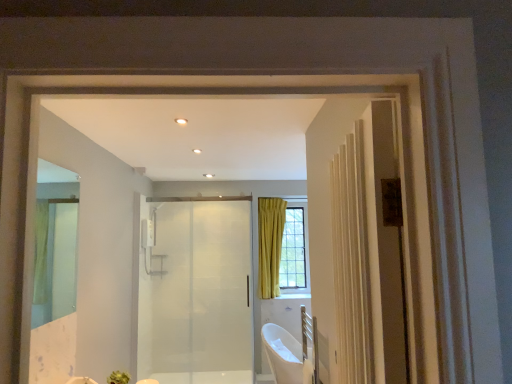
Question: Considering the positions of clear glass mirror at left and transparent glass door at center in the image, is clear glass mirror at left wider or thinner than transparent glass door at center?

Choices:
 (A) wide
 (B) thin

Answer: (B)

Question: Is clear glass mirror at left taller or shorter than transparent glass door at center?

Choices:
 (A) tall
 (B) short

Answer: (B)

Question: Which object is the farthest from the white glossy bathtub at lower center?

Choices:
 (A) clear glass mirror at left
 (B) transparent glass door at center

Answer: (A)

Question: Estimate the real-world distances between objects in this image. Which object is farther from the transparent glass door at center?

Choices:
 (A) clear glass mirror at left
 (B) white glossy bathtub at lower center

Answer: (A)